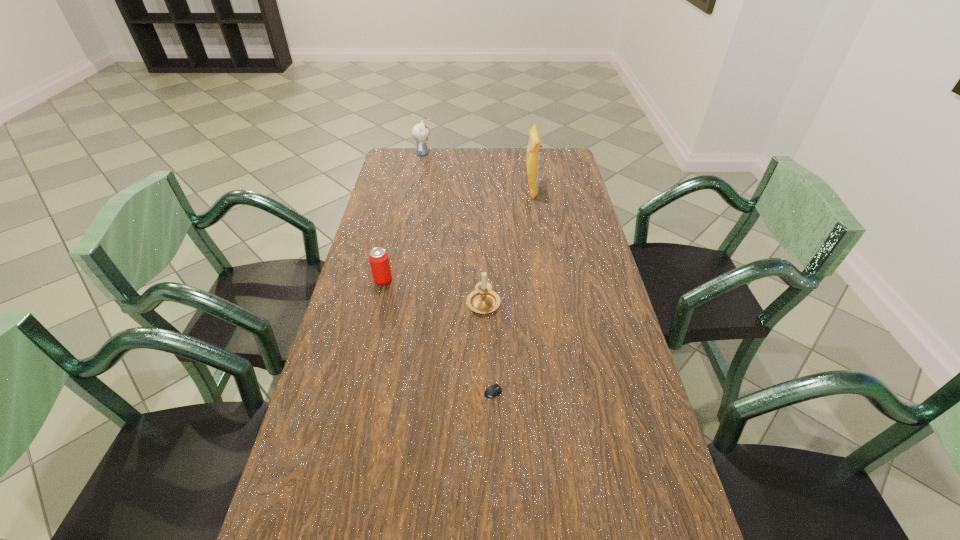
Select which object is the fourth closest to the tallest object. Please provide its 2D coordinates. Your answer should be formatted as a tuple, i.e. [(x, y)], where the tuple contains the x and y coordinates of a point satisfying the conditions above.

[(494, 390)]

This screenshot has height=540, width=960. Identify the location of object that is the fourth closest to the beer can. (420, 132).

This screenshot has height=540, width=960. I want to click on vacant space that satisfies the following two spatial constraints: 1. with a handle on the side of the fourth farthest object; 2. on the front-facing side of the farthest object, so click(x=482, y=153).

You are a GUI agent. You are given a task and a screenshot of the screen. Output one action in this format:
    pyautogui.click(x=<x>, y=<y>)
    Task: Click on the vacant space that satisfies the following two spatial constraints: 1. on the front side of the beer can; 2. on the right side of the shortest object
    
    Given the screenshot: What is the action you would take?
    pyautogui.click(x=357, y=390)

This screenshot has height=540, width=960. What are the coordinates of `vacant space that satisfies the following two spatial constraints: 1. on the front-facing side of the farthest object; 2. on the front side of the third nearest object` in the screenshot? It's located at (397, 280).

Locate an element on the screen. The width and height of the screenshot is (960, 540). vacant space that satisfies the following two spatial constraints: 1. on the front-facing side of the kitten; 2. on the front side of the third farthest object is located at coordinates (397, 280).

You are a GUI agent. You are given a task and a screenshot of the screen. Output one action in this format:
    pyautogui.click(x=<x>, y=<y>)
    Task: Click on the vacant space that satisfies the following two spatial constraints: 1. with a handle on the side of the candle holder; 2. on the front-facing side of the kitten
    This screenshot has width=960, height=540.
    Given the screenshot: What is the action you would take?
    pyautogui.click(x=482, y=153)

You are a GUI agent. You are given a task and a screenshot of the screen. Output one action in this format:
    pyautogui.click(x=<x>, y=<y>)
    Task: Click on the blank area in the image that satisfies the following two spatial constraints: 1. on the front-facing side of the nearest object; 2. on the right side of the kitten
    The image size is (960, 540).
    Given the screenshot: What is the action you would take?
    pyautogui.click(x=375, y=390)